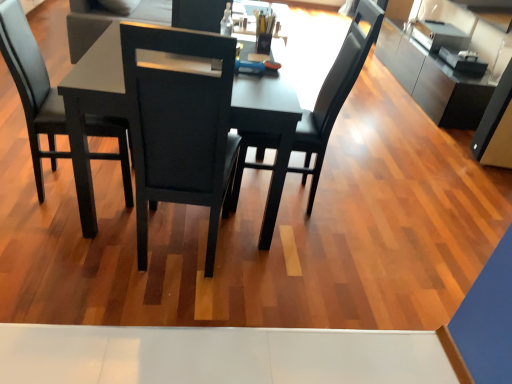
What do you see at coordinates (334, 94) in the screenshot?
I see `black matte chair at center, which appears as the 2th chair when viewed from the left` at bounding box center [334, 94].

The image size is (512, 384). Describe the element at coordinates (32, 87) in the screenshot. I see `black leather chair at left, the 2th chair in the right-to-left sequence` at that location.

This screenshot has width=512, height=384. In order to click on satin silver cabinet at upper right in this screenshot , I will do `click(443, 60)`.

What's the angular difference between satin silver cabinet at upper right and black leather chair at left, the first chair from the left,'s facing directions?

There is a 176-degree angle between the facing directions of satin silver cabinet at upper right and black leather chair at left, the first chair from the left.

Is black leather chair at left, the first chair from the left, surrounded by satin silver cabinet at upper right?

Actually, black leather chair at left, the first chair from the left, is outside satin silver cabinet at upper right.

Is satin silver cabinet at upper right facing away from black leather chair at left, the 2th chair in the right-to-left sequence?

Result: satin silver cabinet at upper right is not turned away from black leather chair at left, the 2th chair in the right-to-left sequence.

From the image's perspective, between satin silver cabinet at upper right and black leather chair at left, the 2th chair in the right-to-left sequence, who is located below?

black leather chair at left, the 2th chair in the right-to-left sequence, appears lower in the image.

Is black leather chair at left, the first chair from the left, surrounding satin silver cabinet at upper right?

Actually, satin silver cabinet at upper right is outside black leather chair at left, the first chair from the left.

From a real-world perspective, between black leather chair at left, the first chair from the left, and satin silver cabinet at upper right, who is vertically higher?

From a 3D spatial view, black leather chair at left, the first chair from the left, is above.

Is point (39, 181) behind point (404, 69)?

That is False.

Considering the relative sizes of satin silver cabinet at upper right and black matte chair at center, the 1th chair when ordered from right to left, in the image provided, is satin silver cabinet at upper right bigger than black matte chair at center, the 1th chair when ordered from right to left,?

Yes.

From the image's perspective, is satin silver cabinet at upper right above or below black matte chair at center, which appears as the 2th chair when viewed from the left?

satin silver cabinet at upper right is above black matte chair at center, which appears as the 2th chair when viewed from the left.

Is satin silver cabinet at upper right inside or outside of black matte chair at center, the 1th chair when ordered from right to left?

The correct answer is: outside.

Could you tell me if satin silver cabinet at upper right is facing black matte chair at center, the 1th chair when ordered from right to left?

No, satin silver cabinet at upper right does not turn towards black matte chair at center, the 1th chair when ordered from right to left.

Is black matte chair at center, which appears as the 2th chair when viewed from the left, oriented towards black leather chair at left, the 2th chair in the right-to-left sequence?

Yes, black matte chair at center, which appears as the 2th chair when viewed from the left, is facing black leather chair at left, the 2th chair in the right-to-left sequence.

Are black matte chair at center, which appears as the 2th chair when viewed from the left, and black leather chair at left, the 2th chair in the right-to-left sequence, located far from each other?

Actually, black matte chair at center, which appears as the 2th chair when viewed from the left, and black leather chair at left, the 2th chair in the right-to-left sequence, are a little close together.

Is point (366, 4) closer to camera compared to point (112, 121)?

No, (366, 4) is behind (112, 121).

The width and height of the screenshot is (512, 384). I want to click on chair that appears above the black matte chair at center, the 1th chair when ordered from right to left (from the image's perspective), so click(32, 87).

In terms of width, does matte black table at center look wider or thinner when compared to satin silver cabinet at upper right?

Considering their sizes, matte black table at center looks broader than satin silver cabinet at upper right.

Locate an element on the screen. The image size is (512, 384). round table above the satin silver cabinet at upper right (from a real-world perspective) is located at coordinates (270, 130).

Is matte black table at center oriented towards satin silver cabinet at upper right?

No, matte black table at center is not facing towards satin silver cabinet at upper right.

Measure the distance between matte black table at center and satin silver cabinet at upper right.

matte black table at center and satin silver cabinet at upper right are 3.22 meters apart.

From a real-world perspective, is black matte chair at center, which appears as the 2th chair when viewed from the left, physically located above or below matte black table at center?

From a real-world perspective, black matte chair at center, which appears as the 2th chair when viewed from the left, is physically above matte black table at center.

How many degrees apart are the facing directions of black matte chair at center, the 1th chair when ordered from right to left, and matte black table at center?

They differ by 94.8 degrees in their facing directions.

From the image's perspective, between black matte chair at center, the 1th chair when ordered from right to left, and matte black table at center, which one is located above?

From the image's view, black matte chair at center, the 1th chair when ordered from right to left, is above.

From the picture: Is black matte chair at center, the 1th chair when ordered from right to left, surrounded by black leather chair at left, the 2th chair in the right-to-left sequence?

No.

From a real-world perspective, is black leather chair at left, the first chair from the left, above or below black matte chair at center, which appears as the 2th chair when viewed from the left?

Clearly, from a real-world perspective, black leather chair at left, the first chair from the left, is below black matte chair at center, which appears as the 2th chair when viewed from the left.

Is black leather chair at left, the 2th chair in the right-to-left sequence, wider or thinner than black matte chair at center, which appears as the 2th chair when viewed from the left?

Clearly, black leather chair at left, the 2th chair in the right-to-left sequence, has less width compared to black matte chair at center, which appears as the 2th chair when viewed from the left.

Can you tell me how much black leather chair at left, the 2th chair in the right-to-left sequence, and black matte chair at center, which appears as the 2th chair when viewed from the left, differ in facing direction?

The facing directions of black leather chair at left, the 2th chair in the right-to-left sequence, and black matte chair at center, which appears as the 2th chair when viewed from the left, are 169 degrees apart.

Find the location of a particular element. The height and width of the screenshot is (384, 512). the 2nd chair in front of the satin silver cabinet at upper right, starting your count from the anchor is located at coordinates (32, 87).

In order to click on cabinetry behind the black leather chair at left, the 2th chair in the right-to-left sequence in this screenshot , I will do `click(443, 60)`.

Which object lies further to the anchor point black matte chair at center, which appears as the 2th chair when viewed from the left, satin silver cabinet at upper right or black leather chair at left, the 2th chair in the right-to-left sequence?

satin silver cabinet at upper right is positioned further to the anchor black matte chair at center, which appears as the 2th chair when viewed from the left.

When comparing their distances from matte black table at center, does satin silver cabinet at upper right or black leather chair at left, the 2th chair in the right-to-left sequence, seem further?

Based on the image, satin silver cabinet at upper right appears to be further to matte black table at center.

When comparing their distances from black leather chair at left, the first chair from the left, does matte black table at center or black matte chair at center, which appears as the 2th chair when viewed from the left, seem further?

black matte chair at center, which appears as the 2th chair when viewed from the left, is further to black leather chair at left, the first chair from the left.

In the scene shown: Considering their positions, is satin silver cabinet at upper right positioned further to black matte chair at center, the 1th chair when ordered from right to left, than matte black table at center?

Among the two, satin silver cabinet at upper right is located further to black matte chair at center, the 1th chair when ordered from right to left.

Which object lies nearer to the anchor point satin silver cabinet at upper right, black leather chair at left, the first chair from the left, or black matte chair at center, which appears as the 2th chair when viewed from the left?

The object closer to satin silver cabinet at upper right is black matte chair at center, which appears as the 2th chair when viewed from the left.

Looking at the image, which one is located further to black matte chair at center, the 1th chair when ordered from right to left, black leather chair at left, the 2th chair in the right-to-left sequence, or matte black table at center?

black leather chair at left, the 2th chair in the right-to-left sequence.

When comparing their distances from satin silver cabinet at upper right, does matte black table at center or black matte chair at center, the 1th chair when ordered from right to left, seem further?

Among the two, matte black table at center is located further to satin silver cabinet at upper right.

When comparing their distances from black matte chair at center, which appears as the 2th chair when viewed from the left, does black leather chair at left, the first chair from the left, or satin silver cabinet at upper right seem closer?

Based on the image, black leather chair at left, the first chair from the left, appears to be nearer to black matte chair at center, which appears as the 2th chair when viewed from the left.

Find the location of a particular element. chair between matte black table at center and satin silver cabinet at upper right from left to right is located at coordinates (334, 94).

Identify the location of chair between black leather chair at left, the first chair from the left, and satin silver cabinet at upper right, in the horizontal direction. (334, 94).

Where is `round table between black leather chair at left, the first chair from the left, and black matte chair at center, the 1th chair when ordered from right to left`? The height and width of the screenshot is (384, 512). round table between black leather chair at left, the first chair from the left, and black matte chair at center, the 1th chair when ordered from right to left is located at coordinates tap(270, 130).

Where is `round table between black leather chair at left, the 2th chair in the right-to-left sequence, and satin silver cabinet at upper right from left to right`? The image size is (512, 384). round table between black leather chair at left, the 2th chair in the right-to-left sequence, and satin silver cabinet at upper right from left to right is located at coordinates (270, 130).